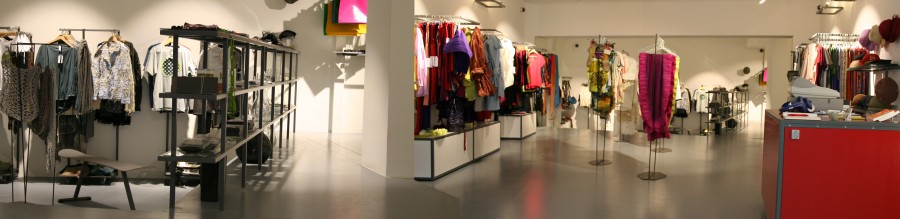
The image size is (900, 219). What are the coordinates of `the back walls` in the screenshot? It's located at (315, 73), (714, 15).